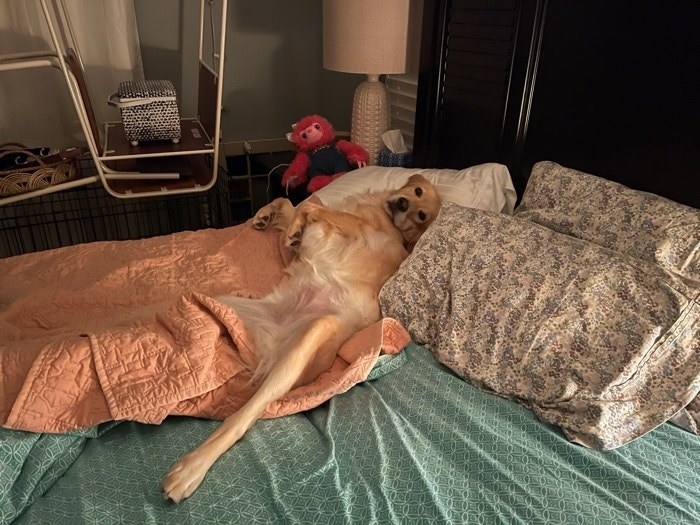
At what (x,y) coordinates should I click in order to perform the action: click on white curtain. Please return your answer as a coordinate pair (x, y). The width and height of the screenshot is (700, 525). Looking at the image, I should click on coord(106,36).